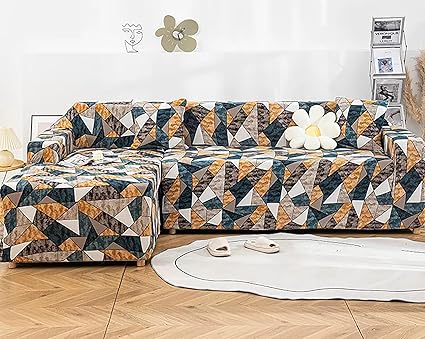
Where is `white rug`? The image size is (425, 339). white rug is located at coordinates (343, 264).